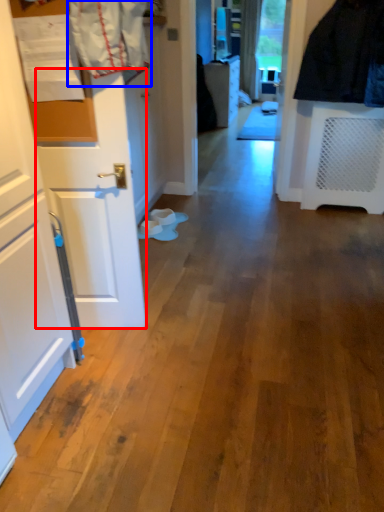
Question: Which object appears farthest to the camera in this image, door (highlighted by a red box) or laundry (highlighted by a blue box)?

Choices:
 (A) door
 (B) laundry

Answer: (A)